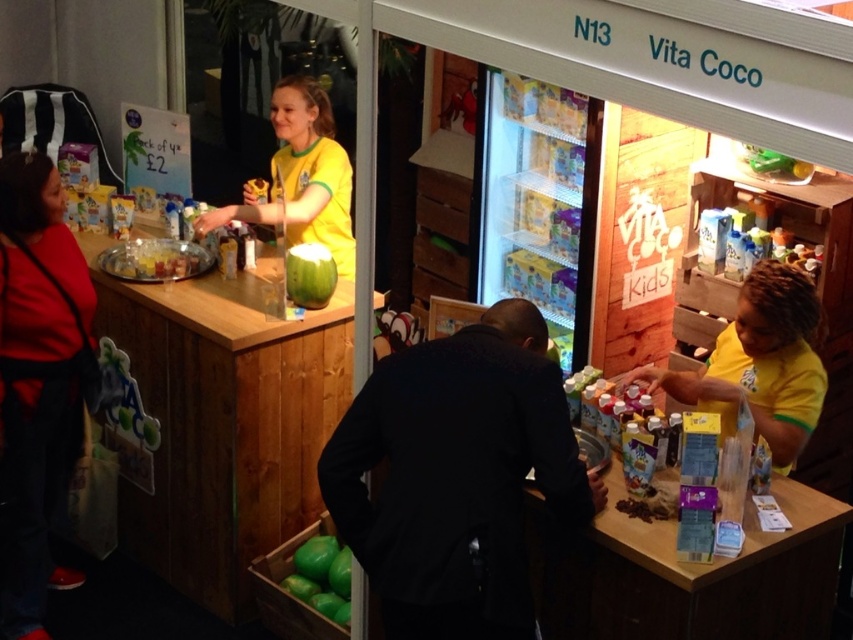
You are a customer at the Vita Coco booth and want to pick up both the black matte jacket at center and the yellow matte shirt at right. Which item should you reach for first if you want to grab the one that is closer to you?

The black matte jacket at center is positioned under the yellow matte shirt at right, so it is closer to you. Reach for the black matte jacket at center first.

You are a customer at the Vita Coco booth and you want to grab the green matte coconut at lower center. However, you notice the yellow matte shirt at right is blocking your view. Can you reach the coconut without moving the shirt?

The yellow matte shirt at right is in front of the green matte coconut at lower center, so you would need to move the shirt to access the coconut.

In the scene shown: You are at the Vita Coco booth and need to place a new sign between the two points, point (x=799, y=436) and point (x=310, y=570). According to the layout, which point should the sign be closer to if it needs to be placed in front of the other point?

The sign should be placed closer to point (x=310, y=570) because point (x=799, y=436) is in front of it, meaning the sign needs to be positioned behind point (x=799, y=436) to be in front of point (x=310, y=570).